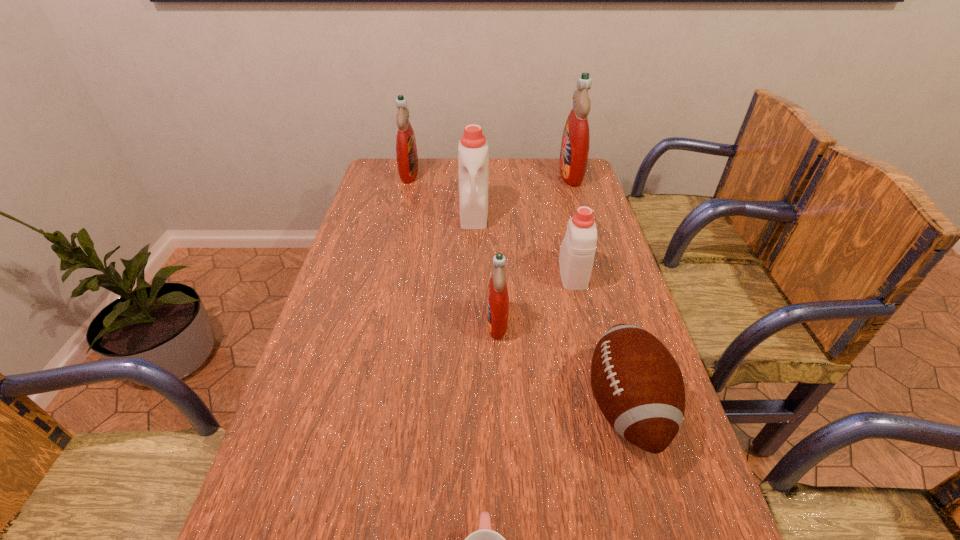
Locate an element on the screen. The image size is (960, 540). the second shortest object is located at coordinates (637, 384).

The height and width of the screenshot is (540, 960). What are the coordinates of `football` in the screenshot? It's located at (637, 384).

The height and width of the screenshot is (540, 960). I want to click on free space located 0.050m on the front surface of the biggest red detergent, so click(x=545, y=174).

Identify the location of vacant space located 0.280m on the front surface of the biggest red detergent. This screenshot has height=540, width=960. (x=487, y=174).

At what (x,y) coordinates should I click in order to perform the action: click on free space located 0.200m on the front surface of the biggest red detergent. Please return your answer as a coordinate pair (x, y). This screenshot has height=540, width=960. Looking at the image, I should click on (507, 174).

Identify the location of free space located 0.390m on the front surface of the leftmost red detergent. This screenshot has width=960, height=540. (519, 174).

Where is `vacant area situated on the handle side of the third farthest detergent`? The image size is (960, 540). vacant area situated on the handle side of the third farthest detergent is located at coordinates (473, 249).

I want to click on free location located 0.090m on the handle side of the second nearest detergent, so (564, 239).

Locate an element on the screen. The height and width of the screenshot is (540, 960). vacant position located 0.390m on the handle side of the second nearest detergent is located at coordinates coord(553,190).

Locate an element on the screen. The width and height of the screenshot is (960, 540). vacant space located 0.100m on the handle side of the second nearest detergent is located at coordinates [564, 237].